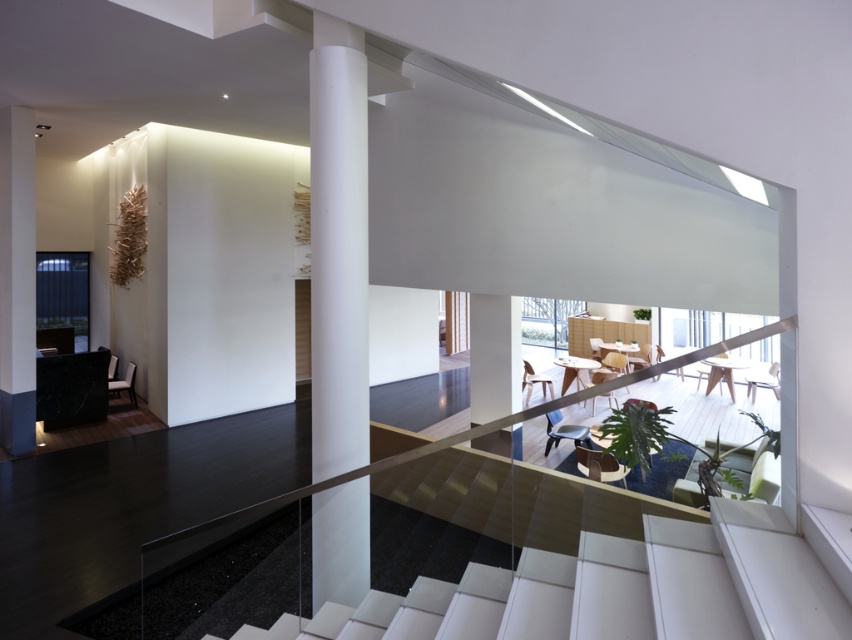
Is point (722, 614) positioned behind point (323, 596)?

No.

Locate an element on the screen. white glossy stair at center is located at coordinates (613, 589).

This screenshot has height=640, width=852. Identify the location of white glossy stair at center. (613, 589).

Is point (363, 451) behind point (0, 180)?

No.

Which is behind, point (327, 116) or point (32, 204)?

Point (32, 204)

Find the location of `white glossy column at center`. white glossy column at center is located at coordinates (338, 248).

Can you confirm if white glossy stair at center is thinner than white matte column at upper left?

Incorrect, white glossy stair at center's width is not less than white matte column at upper left's.

Which of these two, white glossy stair at center or white matte column at upper left, stands shorter?

With less height is white glossy stair at center.

Image resolution: width=852 pixels, height=640 pixels. I want to click on white glossy stair at center, so click(x=613, y=589).

What are the coordinates of `white glossy stair at center` in the screenshot? It's located at (613, 589).